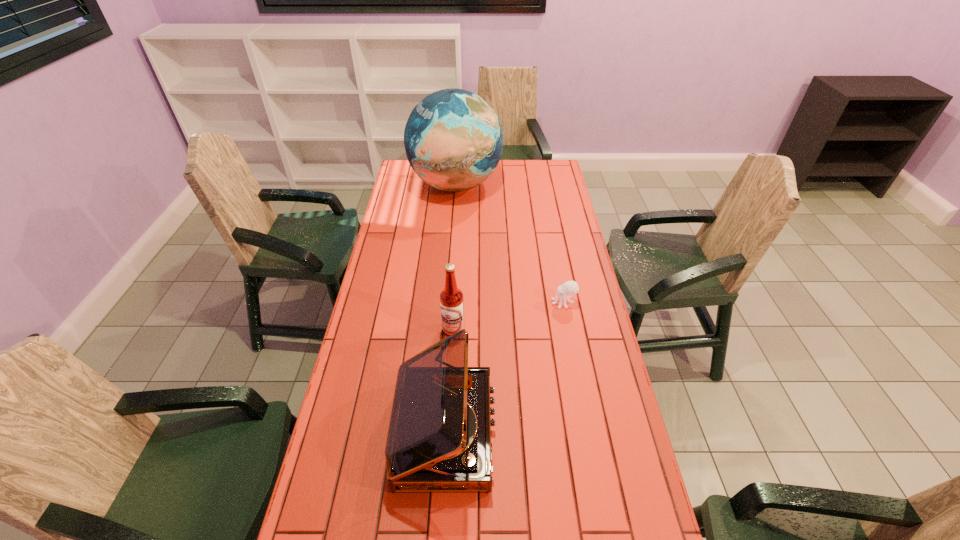
Where is `blank region between the alcohol and the rightmost object`? Image resolution: width=960 pixels, height=540 pixels. blank region between the alcohol and the rightmost object is located at coordinates (509, 316).

The image size is (960, 540). I want to click on vacant region between the shortest object and the tallest object, so click(510, 244).

Identify the location of vacant point located between the farthest object and the shortest object. The height and width of the screenshot is (540, 960). (510, 244).

In order to click on vacant area that lies between the third farthest object and the tallest object in this screenshot , I will do `click(455, 257)`.

At what (x,y) coordinates should I click in order to perform the action: click on object that is the second closest to the shortest object. Please return your answer as a coordinate pair (x, y). This screenshot has height=540, width=960. Looking at the image, I should click on (439, 437).

Where is `the second closest object to the record player`? Image resolution: width=960 pixels, height=540 pixels. the second closest object to the record player is located at coordinates (569, 288).